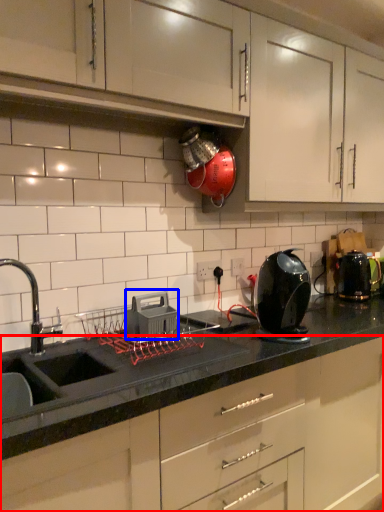
Question: Which point is closer to the camera, cabinetry (highlighted by a red box) or appliance (highlighted by a blue box)?

Choices:
 (A) cabinetry
 (B) appliance

Answer: (A)